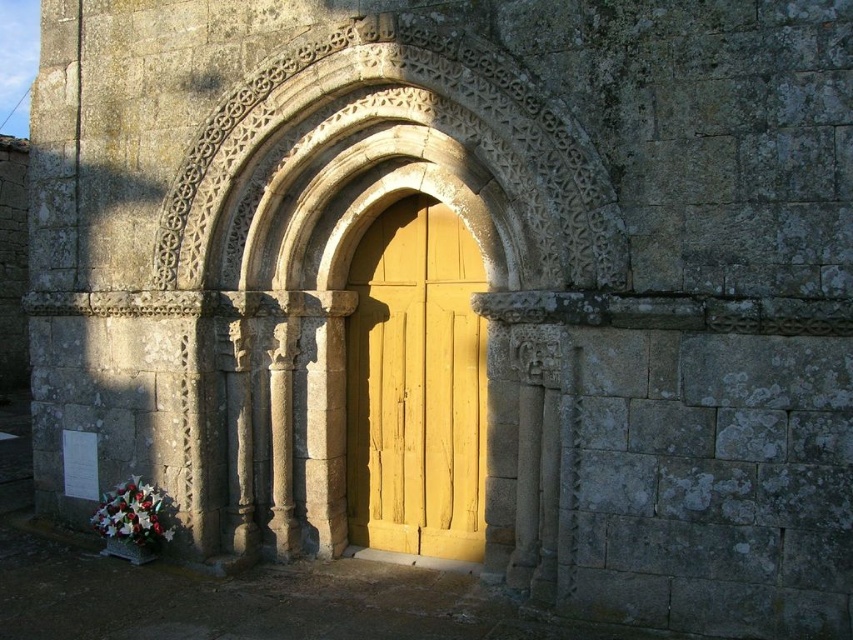
You are a painter who wants to paint a mural on the wall between the carved stone archway at center and the yellow wood door at center. The mural requires a space of 1 meter. Is there enough space between them?

The carved stone archway at center and yellow wood door at center are 99.53 centimeters apart from each other. Since 99.53 centimeters is slightly less than 1 meter, there is not enough space to paint the mural requiring 1 meter between them.

You are an architect planning to install a new decorative element between the carved stone archway at center and the yellow wood door at center. Given their widths, which object should the element be placed closer to to ensure it fits within the space?

The carved stone archway at center is wider than the yellow wood door at center. Therefore, the decorative element should be placed closer to the narrower yellow wood door at center to ensure it fits within the available space.

Consider the image. You are standing in front of the carved stone archway at center and the yellow wood door at center. Which object is nearer to you?

The carved stone archway at center is closer to the viewer than the yellow wood door at center, so it is nearer.